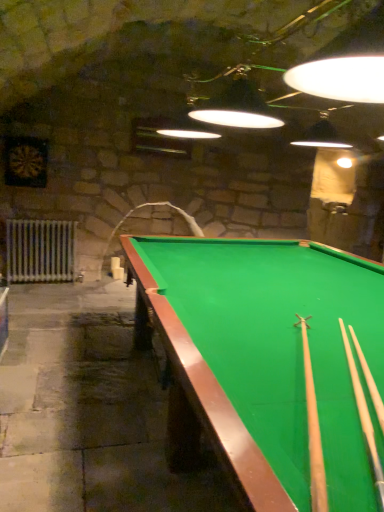
Question: Would you say white metallic radiator at left is inside or outside green felt billiard table at center?

Choices:
 (A) outside
 (B) inside

Answer: (A)

Question: Is white metallic radiator at left taller or shorter than green felt billiard table at center?

Choices:
 (A) tall
 (B) short

Answer: (B)

Question: Considering the real-world distances, which object is farthest from the light wood cue at right, which appears as the 1th cue when viewed from the right?

Choices:
 (A) light brown wood cue at center, which appears as the 1th cue when viewed from the left
 (B) white metallic radiator at left
 (C) green felt billiard table at center

Answer: (B)

Question: Considering the real-world distances, which object is closest to the white metallic radiator at left?

Choices:
 (A) light brown wood cue at center, which appears as the 1th cue when viewed from the left
 (B) green felt billiard table at center
 (C) light wood cue at right, which appears as the second cue when viewed from the left

Answer: (B)